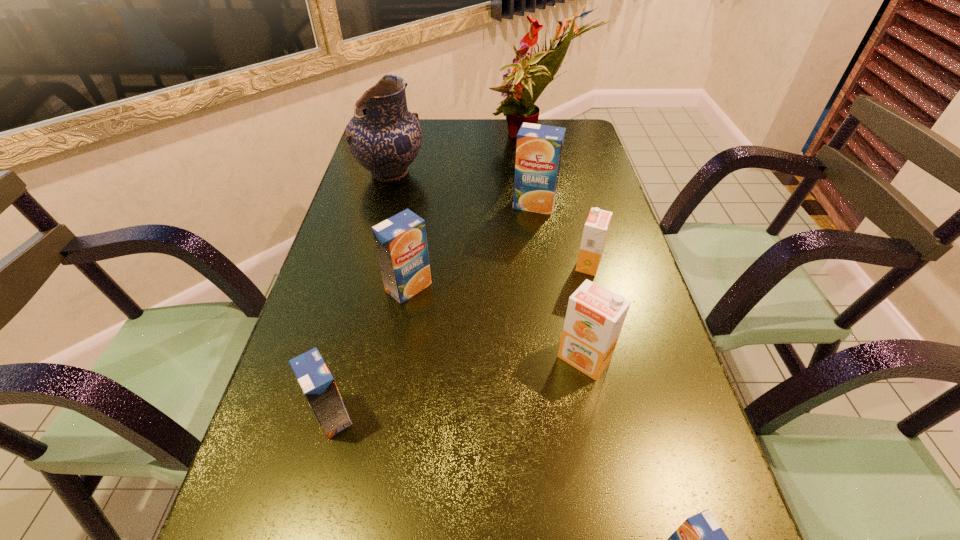
This screenshot has height=540, width=960. Identify the location of the fifth farthest orange_juice. (314, 377).

Locate an element on the screen. The width and height of the screenshot is (960, 540). the farther orange orange juice is located at coordinates 596,228.

Image resolution: width=960 pixels, height=540 pixels. What are the coordinates of `blank area located 0.130m on the front-facing side of the tallest object` in the screenshot? It's located at (445, 139).

In order to click on vacant space situated on the front-facing side of the tallest object in this screenshot , I will do `click(409, 139)`.

Locate an element on the screen. The width and height of the screenshot is (960, 540). free location located on the front-facing side of the tallest object is located at coordinates (436, 139).

Find the location of a particular element. This screenshot has height=540, width=960. blank space located 0.060m on the back of the blue pottery is located at coordinates (397, 146).

I want to click on vacant space situated 0.320m on the front of the third blue orange_juice from left to right, so click(549, 305).

The height and width of the screenshot is (540, 960). I want to click on vacant space located 0.220m on the right of the third nearest blue orange_juice, so point(530,287).

Where is `free space located 0.230m on the front of the third nearest object`? The height and width of the screenshot is (540, 960). free space located 0.230m on the front of the third nearest object is located at coordinates (615, 516).

Locate an element on the screen. Image resolution: width=960 pixels, height=540 pixels. free space located on the right of the third farthest blue orange_juice is located at coordinates (584, 416).